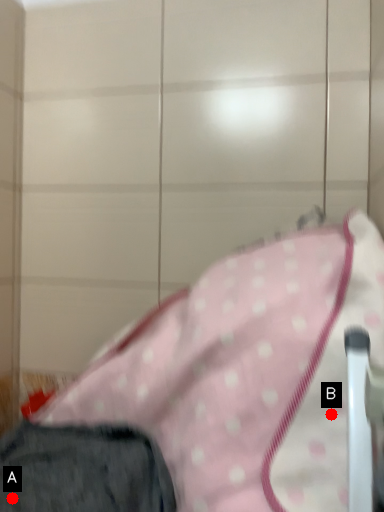
Question: Two points are circled on the image, labeled by A and B beside each circle. Which point is closer to the camera?

Choices:
 (A) A is closer
 (B) B is closer

Answer: (B)